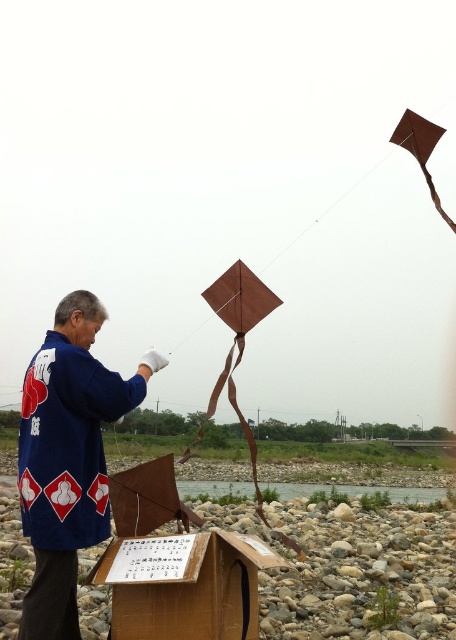
Question: Which object is positioned farthest from the brown cardboard box at lower center?

Choices:
 (A) brown matte kite at upper right
 (B) blue fabric jacket at center

Answer: (A)

Question: Observing the image, what is the correct spatial positioning of brown cardboard box at lower center in reference to brown matte kite at upper right?

Choices:
 (A) left
 (B) right

Answer: (A)

Question: Is blue fabric jacket at center smaller than brown cardboard box at lower center?

Choices:
 (A) yes
 (B) no

Answer: (B)

Question: Based on their relative distances, which object is nearer to the brown matte kite at upper right?

Choices:
 (A) brown cardboard box at lower center
 (B) blue fabric jacket at center

Answer: (A)

Question: Among these points, which one is farthest from the camera?

Choices:
 (A) (404, 128)
 (B) (25, 611)
 (C) (160, 586)

Answer: (A)

Question: Does brown cardboard box at lower center have a smaller size compared to brown matte kite at upper right?

Choices:
 (A) yes
 (B) no

Answer: (A)